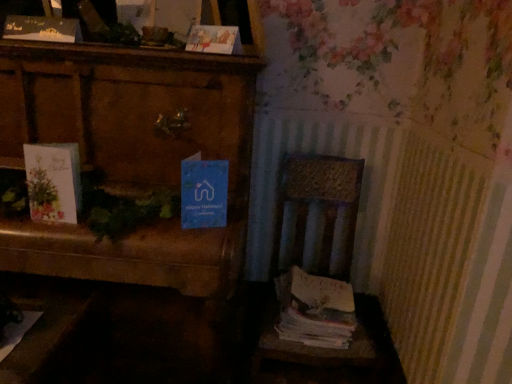
Question: Are white paper stack at right and matte paper card at upper center, the first paperback book viewed from the right, located far from each other?

Choices:
 (A) no
 (B) yes

Answer: (A)

Question: From the image's perspective, is white paper stack at right under matte paper card at upper center, which appears as the 2th paperback book when viewed from the top?

Choices:
 (A) no
 (B) yes

Answer: (B)

Question: From the image's perspective, does white paper stack at right appear higher than matte paper card at upper center, which appears as the 2th paperback book when viewed from the top?

Choices:
 (A) no
 (B) yes

Answer: (A)

Question: From a real-world perspective, is white paper stack at right located higher than matte paper card at upper center, which appears as the 2th paperback book when viewed from the top?

Choices:
 (A) yes
 (B) no

Answer: (B)

Question: Is white paper stack at right next to matte paper card at upper center, which appears as the 2th paperback book when viewed from the top, and touching it?

Choices:
 (A) no
 (B) yes

Answer: (A)

Question: Is matte paper card at upper center, the first paperback book viewed from the right, inside or outside of blue paper at center, the third paperback book viewed from the top?

Choices:
 (A) outside
 (B) inside

Answer: (A)

Question: From the image's perspective, relative to blue paper at center, the first paperback book ordered from the bottom, is matte paper card at upper center, which appears as the 2th paperback book when viewed from the top, above or below?

Choices:
 (A) above
 (B) below

Answer: (A)

Question: Considering their positions, is matte paper card at upper center, which appears as the 2th paperback book when viewed from the top, located in front of or behind blue paper at center, the 2th paperback book in the left-to-right sequence?

Choices:
 (A) behind
 (B) front

Answer: (A)

Question: Is matte paper card at upper center, which is the 2th paperback book in bottom-to-top order, to the left or to the right of blue paper at center, the third paperback book viewed from the top, in the image?

Choices:
 (A) right
 (B) left

Answer: (A)

Question: Is point pos(115,157) closer or farther from the camera than point pos(7,31)?

Choices:
 (A) closer
 (B) farther

Answer: (B)

Question: Considering the relative positions of wooden chest at left and matte black card at upper left, which is counted as the third paperback book, starting from the right, in the image provided, is wooden chest at left to the left or to the right of matte black card at upper left, which is counted as the third paperback book, starting from the right,?

Choices:
 (A) left
 (B) right

Answer: (B)

Question: From the image's perspective, is wooden chest at left located above or below matte black card at upper left, which is counted as the third paperback book, starting from the right?

Choices:
 (A) below
 (B) above

Answer: (A)

Question: Which is correct: wooden chest at left is inside matte black card at upper left, acting as the 1th paperback book starting from the top, or outside of it?

Choices:
 (A) inside
 (B) outside

Answer: (B)

Question: Considering the positions of point (344, 339) and point (26, 36), is point (344, 339) closer or farther from the camera than point (26, 36)?

Choices:
 (A) farther
 (B) closer

Answer: (A)

Question: Is white paper stack at right to the left or to the right of matte black card at upper left, which is counted as the third paperback book, starting from the right, in the image?

Choices:
 (A) right
 (B) left

Answer: (A)